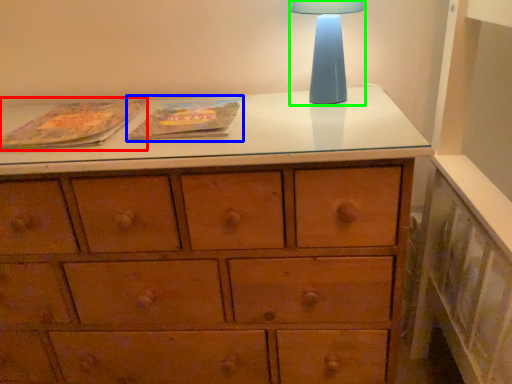
Question: Which object is the farthest from paperback book (highlighted by a red box)? Choose among these: paperback book (highlighted by a blue box) or table lamp (highlighted by a green box).

Choices:
 (A) paperback book
 (B) table lamp

Answer: (B)